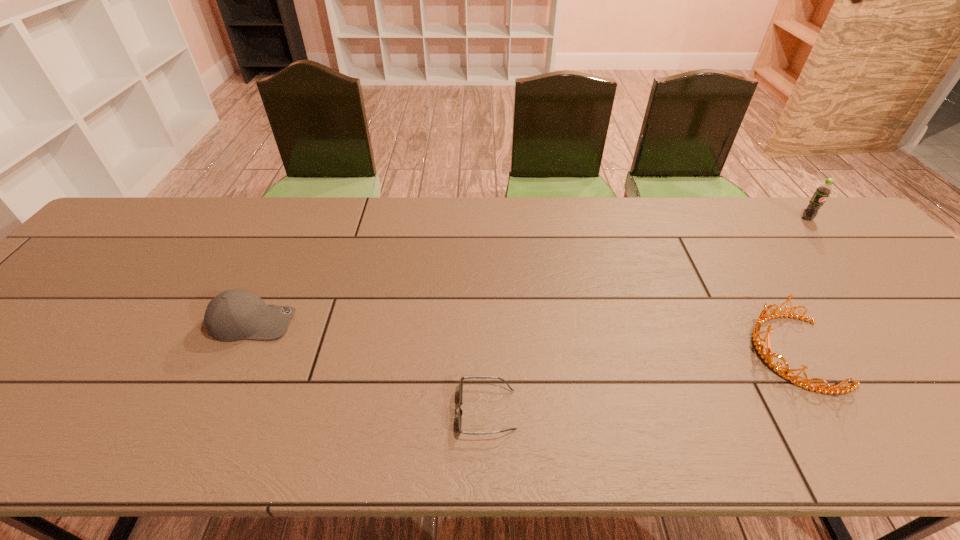
Identify the location of vacant space at the right edge of the desktop. This screenshot has height=540, width=960. (842, 260).

In the image, there is a desktop. Where is `vacant space at the far left corner`? This screenshot has width=960, height=540. vacant space at the far left corner is located at coordinates (158, 198).

The height and width of the screenshot is (540, 960). Find the location of `free space at the far right corner of the desktop`. free space at the far right corner of the desktop is located at coordinates (842, 230).

Locate an element on the screen. The height and width of the screenshot is (540, 960). free space between the baseball cap and the shortest object is located at coordinates (371, 367).

This screenshot has height=540, width=960. What are the coordinates of `vacant space in between the rightmost object and the baseball cap` in the screenshot? It's located at (530, 271).

Identify the location of free area in between the tallest object and the tiara. (800, 285).

At what (x,y) coordinates should I click in order to perform the action: click on vacant space in between the baseball cap and the rightmost object. Please return your answer as a coordinate pair (x, y). This screenshot has height=540, width=960. Looking at the image, I should click on (530, 271).

Find the location of `vacant space that is in between the baseball cap and the second object from left to right`. vacant space that is in between the baseball cap and the second object from left to right is located at coordinates (371, 367).

The image size is (960, 540). In order to click on free space between the sunglasses and the leftmost object in this screenshot , I will do `click(371, 367)`.

Locate an element on the screen. vacant area that lies between the shortest object and the tiara is located at coordinates (640, 381).